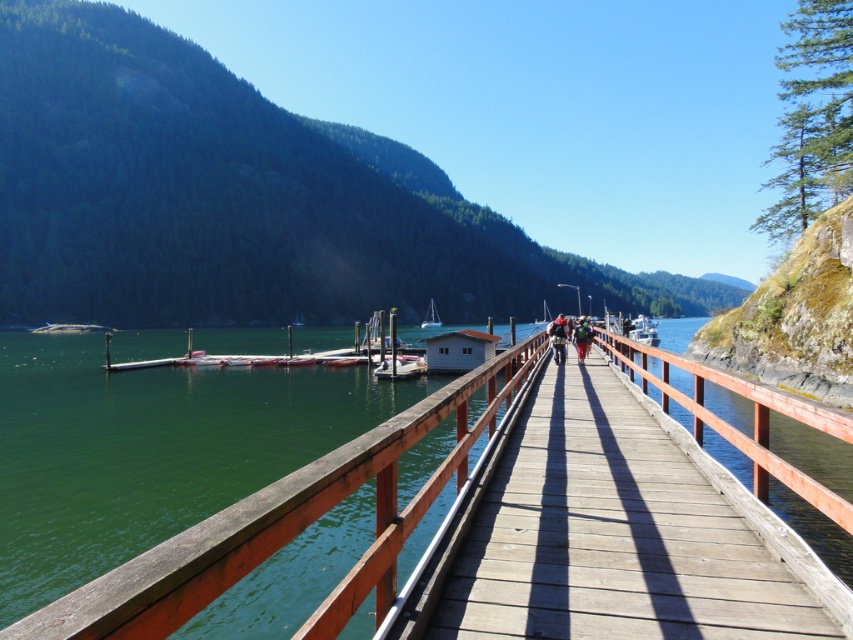
Which is more to the left, matte black backpack at center or green fabric jacket at center?

From the viewer's perspective, green fabric jacket at center appears more on the left side.

Between matte black backpack at center and green fabric jacket at center, which one has more height?

With more height is matte black backpack at center.

What do you see at coordinates (556, 337) in the screenshot?
I see `matte black backpack at center` at bounding box center [556, 337].

I want to click on matte black backpack at center, so click(x=556, y=337).

Does white matte boat at center have a greater width compared to matte black backpack at center?

No.

Does point (387, 369) come in front of point (550, 323)?

No, (387, 369) is behind (550, 323).

The image size is (853, 640). I want to click on white matte boat at center, so click(x=399, y=368).

Which of these two, green forested mountain at upper left or white matte boat at center, stands shorter?

With less height is white matte boat at center.

Which of these two, green forested mountain at upper left or white matte boat at center, stands taller?

green forested mountain at upper left is taller.

Locate an element on the screen. The image size is (853, 640). green forested mountain at upper left is located at coordinates (238, 198).